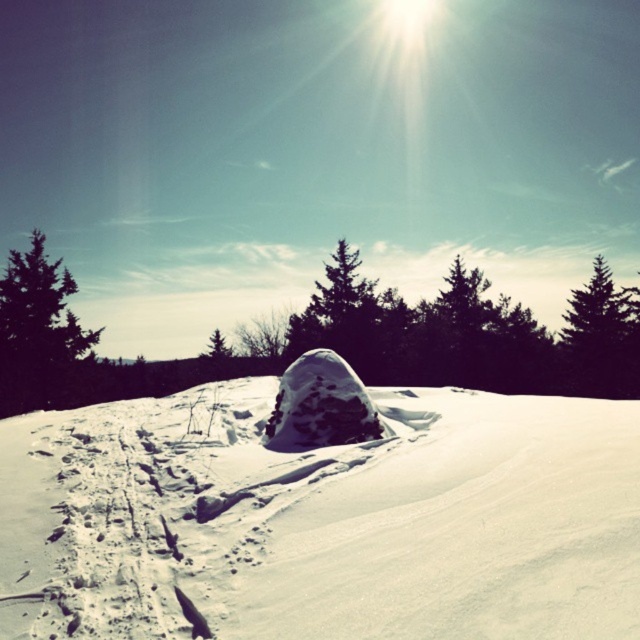
Does green leafy tree at left have a lesser height compared to green textured pine tree at right?

In fact, green leafy tree at left may be taller than green textured pine tree at right.

Does point (64, 326) come farther from viewer compared to point (616, 317)?

No, (64, 326) is closer to viewer.

The image size is (640, 640). Find the location of `green leafy tree at left`. green leafy tree at left is located at coordinates (36, 330).

How distant is white snow-covered mound at center from green leafy tree at left?

24.99 meters

The image size is (640, 640). Describe the element at coordinates (321, 515) in the screenshot. I see `white snow-covered mound at center` at that location.

The width and height of the screenshot is (640, 640). What are the coordinates of `white snow-covered mound at center` in the screenshot? It's located at (321, 515).

Locate an element on the screen. The height and width of the screenshot is (640, 640). white snow-covered mound at center is located at coordinates (321, 515).

Who is positioned more to the right, white snow-covered mound at center or green textured pine tree at right?

green textured pine tree at right

Does white snow-covered mound at center appear on the left side of green textured pine tree at right?

Indeed, white snow-covered mound at center is positioned on the left side of green textured pine tree at right.

What do you see at coordinates (321, 515) in the screenshot? The height and width of the screenshot is (640, 640). I see `white snow-covered mound at center` at bounding box center [321, 515].

Locate an element on the screen. This screenshot has width=640, height=640. white snow-covered mound at center is located at coordinates (321, 515).